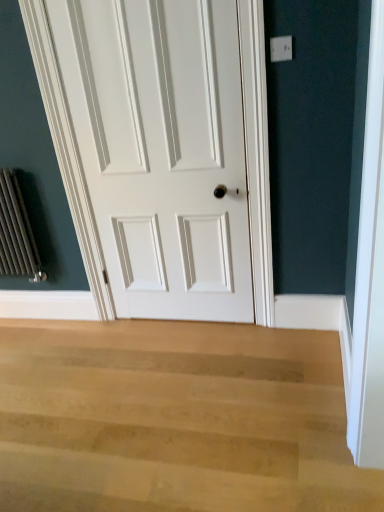
Question: Can you confirm if white painted wood door at center is taller than light wood floor at lower center?

Choices:
 (A) no
 (B) yes

Answer: (B)

Question: Is white painted wood door at center completely or partially outside of light wood floor at lower center?

Choices:
 (A) no
 (B) yes

Answer: (B)

Question: Considering the relative sizes of white painted wood door at center and light wood floor at lower center in the image provided, is white painted wood door at center wider than light wood floor at lower center?

Choices:
 (A) yes
 (B) no

Answer: (B)

Question: From a real-world perspective, is white painted wood door at center positioned under light wood floor at lower center based on gravity?

Choices:
 (A) no
 (B) yes

Answer: (A)

Question: Can you confirm if white painted wood door at center is bigger than light wood floor at lower center?

Choices:
 (A) yes
 (B) no

Answer: (B)

Question: Does white painted wood door at center have a lesser height compared to light wood floor at lower center?

Choices:
 (A) no
 (B) yes

Answer: (A)

Question: Is light wood floor at lower center placed right next to white painted wood door at center?

Choices:
 (A) no
 (B) yes

Answer: (A)

Question: From the image's perspective, is light wood floor at lower center under white painted wood door at center?

Choices:
 (A) no
 (B) yes

Answer: (B)

Question: Is light wood floor at lower center shorter than white painted wood door at center?

Choices:
 (A) yes
 (B) no

Answer: (A)

Question: Considering the relative positions of light wood floor at lower center and white painted wood door at center in the image provided, is light wood floor at lower center in front of white painted wood door at center?

Choices:
 (A) yes
 (B) no

Answer: (A)

Question: Is light wood floor at lower center thinner than white painted wood door at center?

Choices:
 (A) yes
 (B) no

Answer: (B)

Question: Is light wood floor at lower center completely or partially outside of white painted wood door at center?

Choices:
 (A) no
 (B) yes

Answer: (B)

Question: Is light wood floor at lower center bigger or smaller than white painted wood door at center?

Choices:
 (A) small
 (B) big

Answer: (B)